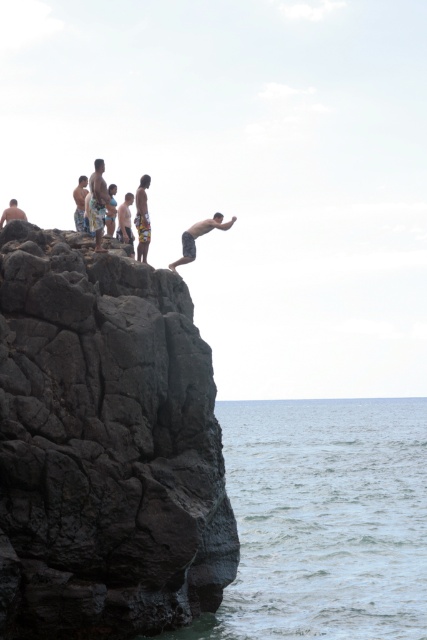
Is light blue shorts at upper center shorter than smooth skin man at upper left?

Correct, light blue shorts at upper center is not as tall as smooth skin man at upper left.

Find the location of `light blue shorts at upper center`. light blue shorts at upper center is located at coordinates (125, 220).

Which of these two, dark gray rocky cliff at upper left or light blue shorts at upper center, stands taller?

light blue shorts at upper center is taller.

Locate an element on the screen. This screenshot has width=427, height=640. dark gray rocky cliff at upper left is located at coordinates (105, 445).

Who is taller, matte skin person at upper center or light brown textured shorts at upper left?

light brown textured shorts at upper left

Measure the distance between point (x=196, y=221) and camera.

Point (x=196, y=221) and camera are 121.73 meters apart.

Image resolution: width=427 pixels, height=640 pixels. I want to click on matte skin person at upper center, so click(198, 236).